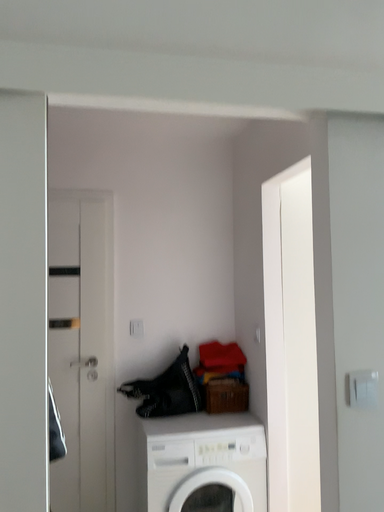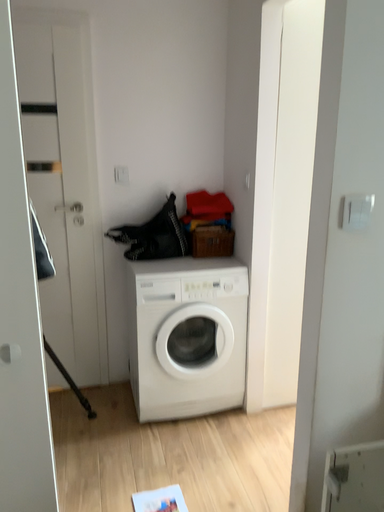
Question: Which way did the camera rotate in the video?

Choices:
 (A) rotated upward
 (B) rotated downward

Answer: (B)